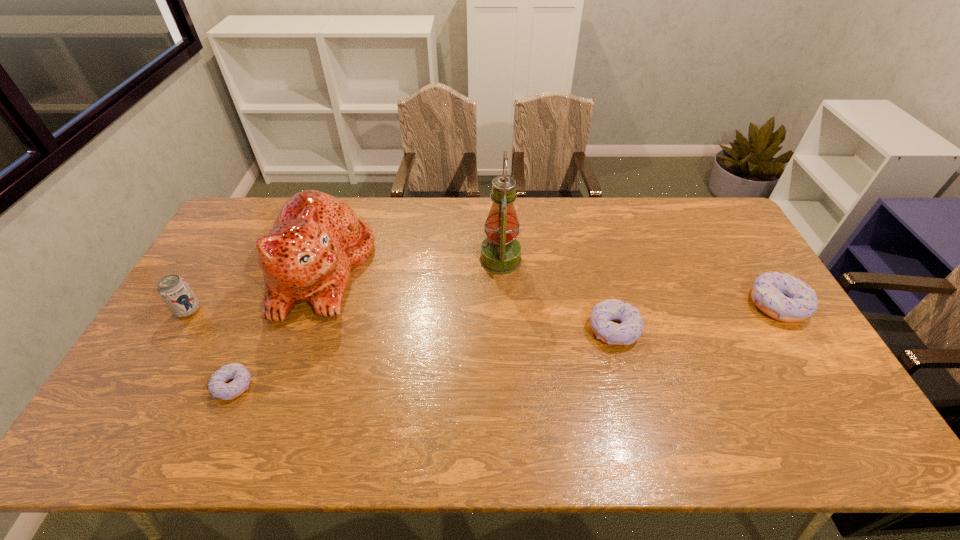
The width and height of the screenshot is (960, 540). I want to click on blank space at the far edge of the desktop, so click(x=529, y=212).

Find the location of a particular element. vacant space at the near edge of the desktop is located at coordinates point(382,397).

This screenshot has width=960, height=540. Identify the location of free space at the left edge of the desktop. (209, 270).

Locate an element on the screen. The height and width of the screenshot is (540, 960). vacant space at the right edge of the desktop is located at coordinates (750, 264).

Locate an element on the screen. The width and height of the screenshot is (960, 540). vacant space at the near left corner of the desktop is located at coordinates (x=162, y=387).

Where is `free space at the far right corner of the desktop`? Image resolution: width=960 pixels, height=540 pixels. free space at the far right corner of the desktop is located at coordinates (690, 202).

The width and height of the screenshot is (960, 540). In order to click on empty space between the tallest object and the second shortest doughnut in this screenshot , I will do `click(557, 295)`.

Locate an element on the screen. This screenshot has width=960, height=540. free space between the third tallest object and the second tallest object is located at coordinates (x=255, y=290).

Where is `blank region between the leftmost object and the rightmost doughnut`? blank region between the leftmost object and the rightmost doughnut is located at coordinates [x=483, y=308].

Locate an element on the screen. The image size is (960, 540). unoccupied area between the tallest object and the cat is located at coordinates (411, 265).